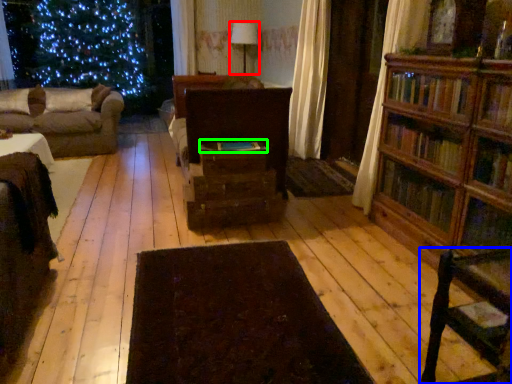
Question: Which object is the closest to the lamp (highlighted by a red box)? Choose among these: chair (highlighted by a blue box) or book (highlighted by a green box).

Choices:
 (A) chair
 (B) book

Answer: (B)